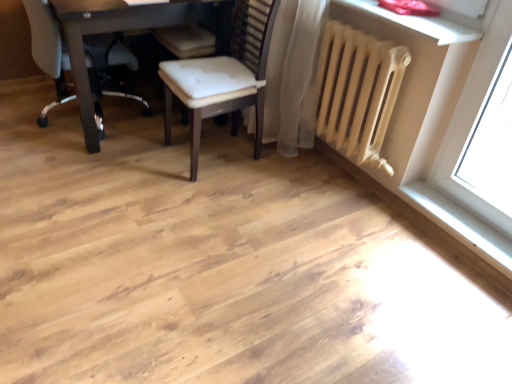
Question: Does white smooth window sill at lower right come in front of white leather chair at upper left, acting as the 2th chair starting from the right?

Choices:
 (A) no
 (B) yes

Answer: (B)

Question: Are white smooth window sill at lower right and white leather chair at upper left, the 1th chair in the left-to-right sequence, located far from each other?

Choices:
 (A) no
 (B) yes

Answer: (B)

Question: Is white smooth window sill at lower right oriented away from white leather chair at upper left, acting as the 2th chair starting from the right?

Choices:
 (A) no
 (B) yes

Answer: (A)

Question: Does white smooth window sill at lower right appear on the right side of white leather chair at upper left, acting as the 2th chair starting from the right?

Choices:
 (A) no
 (B) yes

Answer: (B)

Question: From a real-world perspective, is white smooth window sill at lower right located beneath white leather chair at upper left, the 1th chair in the left-to-right sequence?

Choices:
 (A) no
 (B) yes

Answer: (B)

Question: From a real-world perspective, is white smooth window sill at lower right physically above white leather chair at upper left, the 1th chair in the left-to-right sequence?

Choices:
 (A) yes
 (B) no

Answer: (B)

Question: Does beige matte radiator at upper right have a greater height compared to matte dark brown table at upper left?

Choices:
 (A) no
 (B) yes

Answer: (A)

Question: Is the position of beige matte radiator at upper right less distant than that of matte dark brown table at upper left?

Choices:
 (A) no
 (B) yes

Answer: (B)

Question: From the image's perspective, is beige matte radiator at upper right on matte dark brown table at upper left?

Choices:
 (A) yes
 (B) no

Answer: (B)

Question: Can you confirm if beige matte radiator at upper right is thinner than matte dark brown table at upper left?

Choices:
 (A) yes
 (B) no

Answer: (A)

Question: Is beige matte radiator at upper right facing towards matte dark brown table at upper left?

Choices:
 (A) yes
 (B) no

Answer: (B)

Question: Considering the relative positions of beige matte radiator at upper right and matte dark brown table at upper left in the image provided, is beige matte radiator at upper right to the right of matte dark brown table at upper left from the viewer's perspective?

Choices:
 (A) no
 (B) yes

Answer: (B)

Question: Is matte dark brown table at upper left next to white leather chair at upper left, the 1th chair in the left-to-right sequence?

Choices:
 (A) no
 (B) yes

Answer: (A)